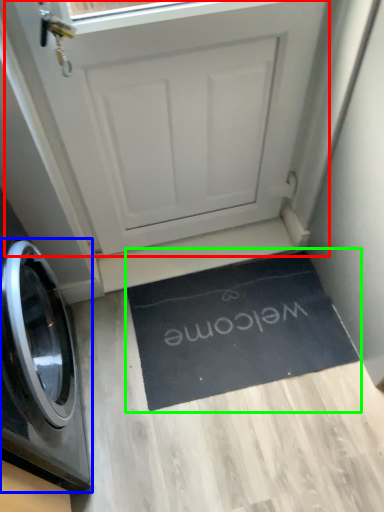
Question: Estimate the real-world distances between objects in this image. Which object is farther from screen door (highlighted by a red box), washing machine (highlighted by a blue box) or doormat (highlighted by a green box)?

Choices:
 (A) washing machine
 (B) doormat

Answer: (A)